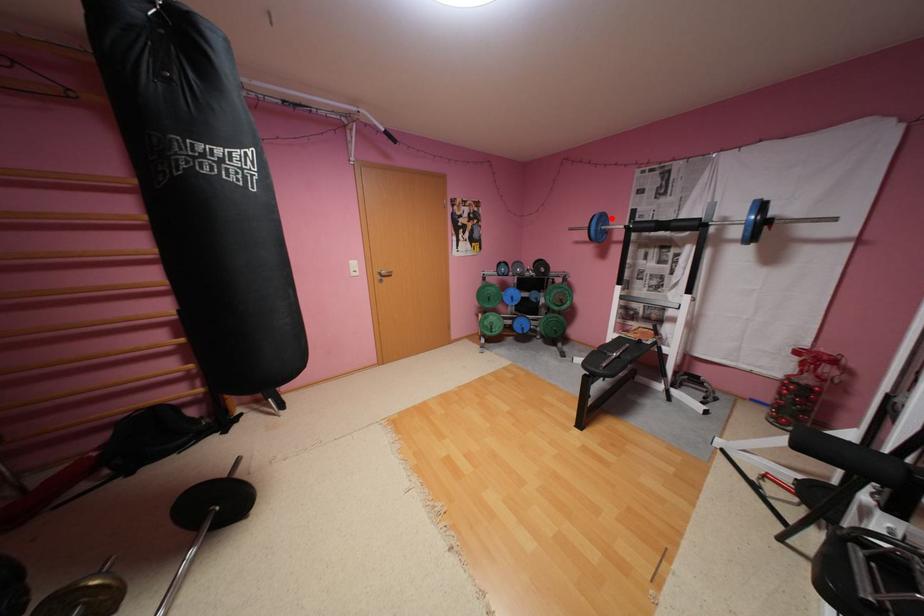
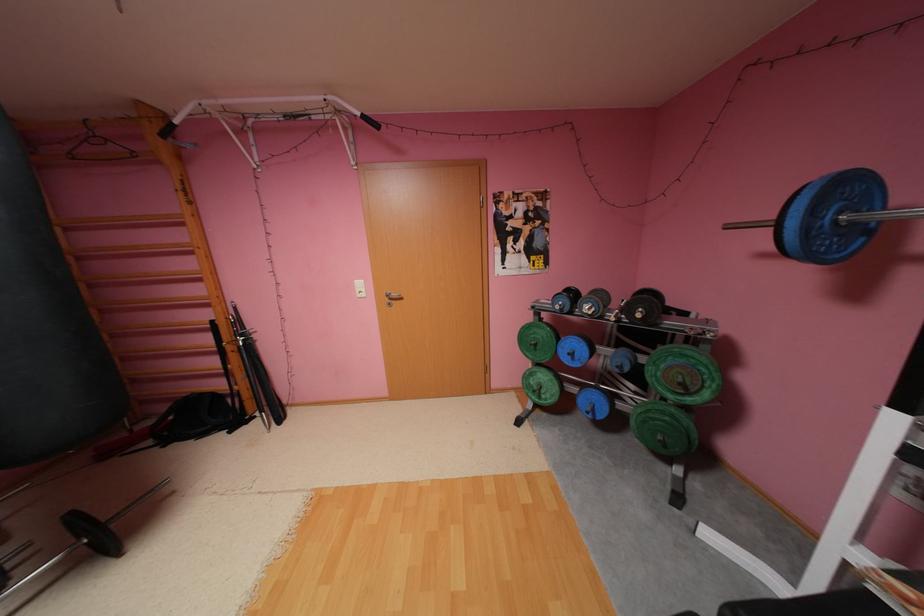
Question: I am providing you with two images of the same scene from different viewpoints. Given a red point in image1, look at the same physical point in image2. Is it:

Choices:
 (A) Closer to the viewpoint
 (B) Farther from the viewpoint

Answer: (B)